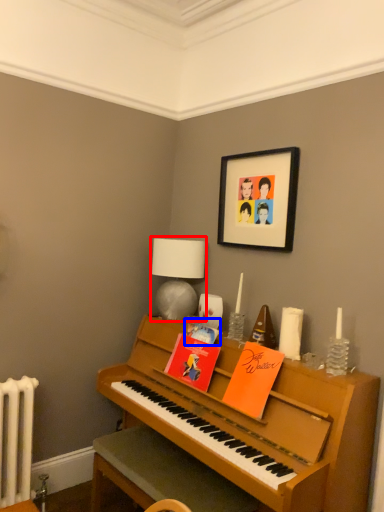
Question: Which point is further to the camera, table lamp (highlighted by a red box) or book (highlighted by a blue box)?

Choices:
 (A) table lamp
 (B) book

Answer: (A)